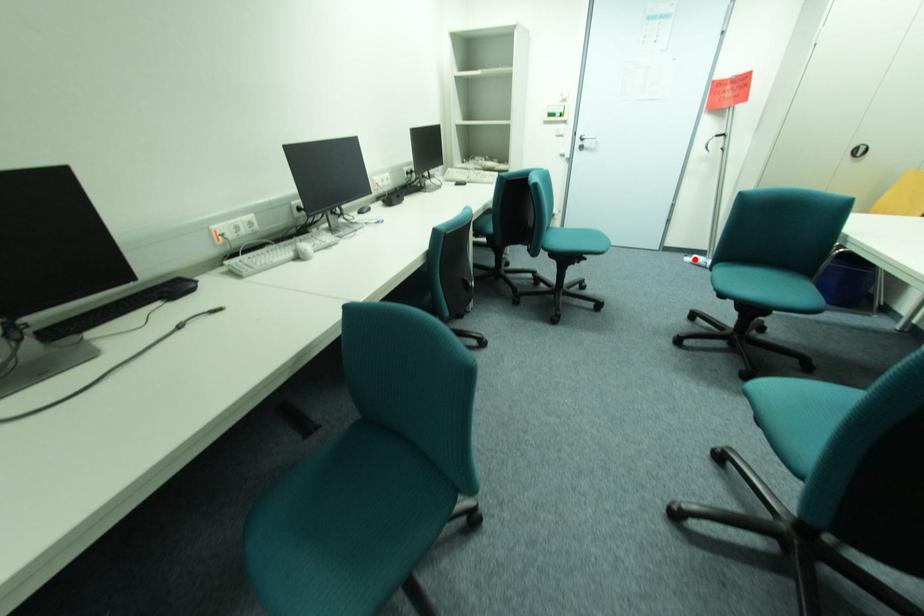
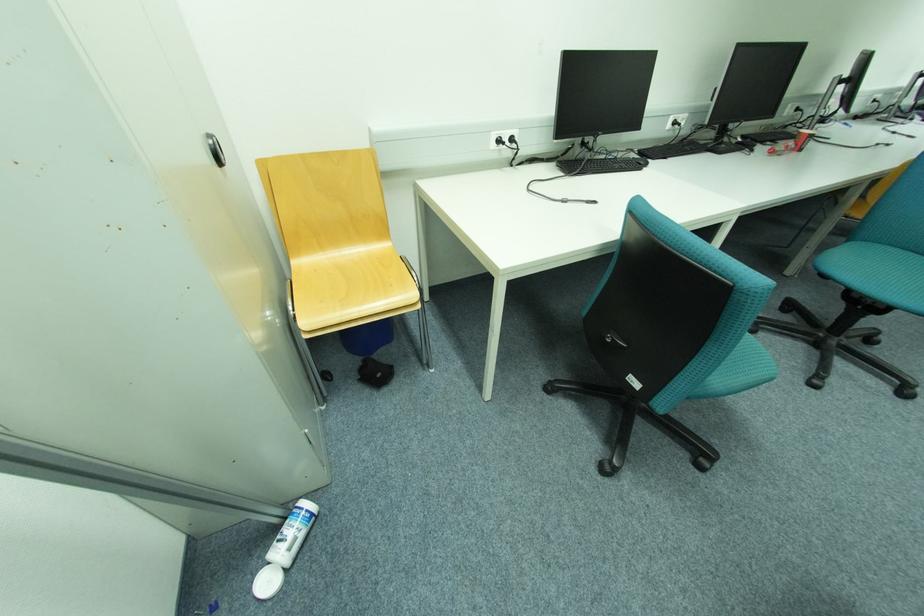
In the second image, find the point that corresponds to the highlighted location in the first image.

(274, 584)